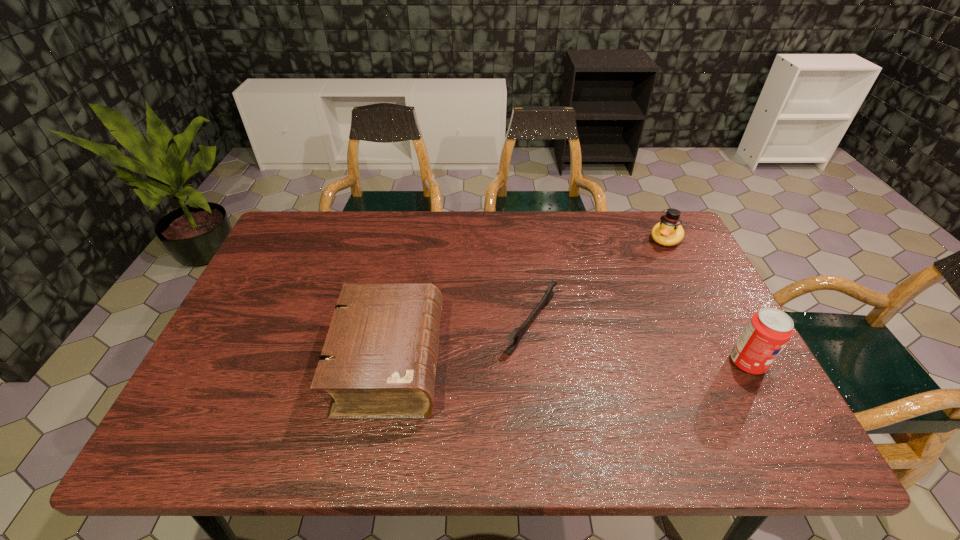
Where is `the leftmost object`? This screenshot has height=540, width=960. the leftmost object is located at coordinates (379, 360).

Where is `soda can`? soda can is located at coordinates (768, 331).

Find the location of a particular element. wrench is located at coordinates (516, 334).

Locate an element on the screen. The height and width of the screenshot is (540, 960). the shortest object is located at coordinates (516, 334).

You are a GUI agent. You are given a task and a screenshot of the screen. Output one action in this format:
    pyautogui.click(x=<x>, y=<y>)
    Task: Click on the duck
    
    Given the screenshot: What is the action you would take?
    pyautogui.click(x=668, y=232)

The height and width of the screenshot is (540, 960). I want to click on vacant space located on the spine side of the Bible, so click(x=578, y=363).

Image resolution: width=960 pixels, height=540 pixels. I want to click on free location located on the open ends of the shortest object, so click(x=705, y=410).

Where is `vacant space located 0.200m on the open ends of the shortest object`? This screenshot has width=960, height=540. vacant space located 0.200m on the open ends of the shortest object is located at coordinates (637, 379).

Where is `free space located 0.330m on the open ends of the shortest object`? The height and width of the screenshot is (540, 960). free space located 0.330m on the open ends of the shortest object is located at coordinates (695, 406).

You are a GUI agent. You are given a task and a screenshot of the screen. Output one action in this format:
    pyautogui.click(x=<x>, y=<y>)
    Task: Click on the free location located 0.180m on the front-facing side of the farthest object
    This screenshot has height=540, width=960.
    Given the screenshot: What is the action you would take?
    pos(636,280)